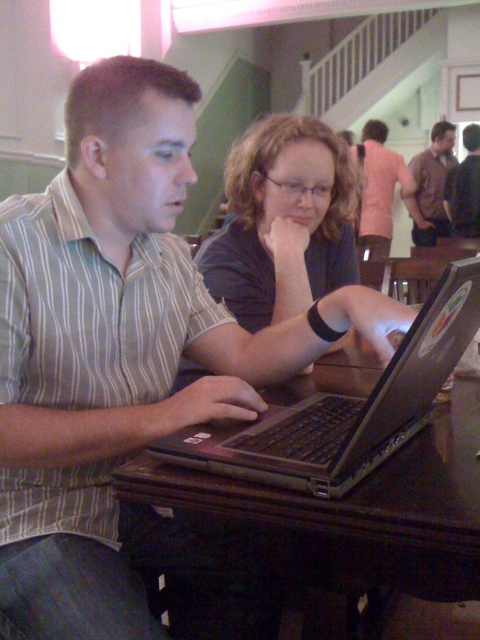
Question: Which is nearer to the brown shirt at upper right?

Choices:
 (A) matte black shirt at center
 (B) pink fabric shirt at upper center
 (C) silver metallic laptop at center

Answer: (B)

Question: Among these objects, which one is nearest to the camera?

Choices:
 (A) brown leather jacket at upper right
 (B) pink fabric shirt at upper center

Answer: (B)

Question: Observing the image, what is the correct spatial positioning of brown wooden table at center in reference to brown leather jacket at upper right?

Choices:
 (A) below
 (B) above

Answer: (A)

Question: Is pink fabric shirt at upper center to the right of brown leather jacket at upper right from the viewer's perspective?

Choices:
 (A) no
 (B) yes

Answer: (A)

Question: Is brown wooden table at center wider than silver metallic laptop at center?

Choices:
 (A) yes
 (B) no

Answer: (A)

Question: Which point is farther to the camera?

Choices:
 (A) (380, 122)
 (B) (446, 192)
 (C) (343, 406)

Answer: (A)